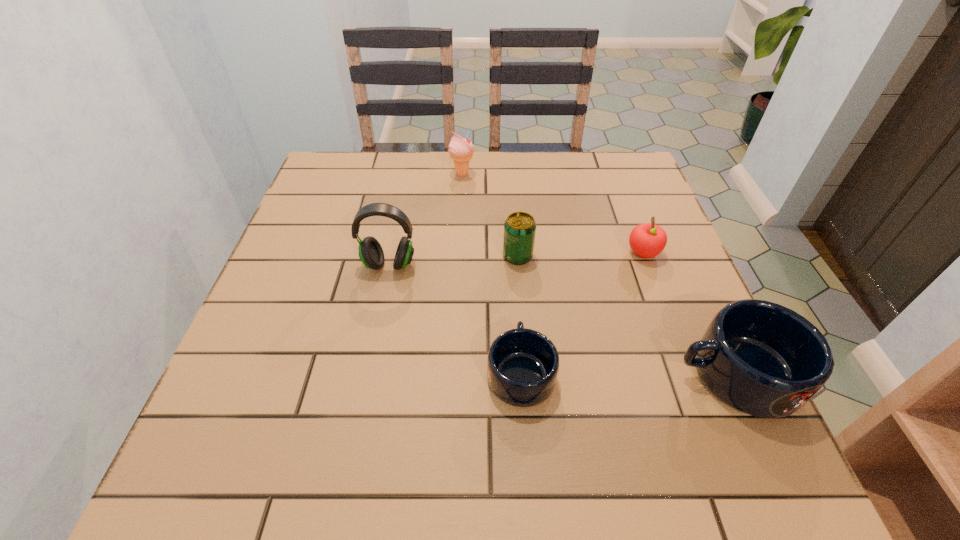
Find the location of a particular element. mug that is positioned at the right edge is located at coordinates (763, 359).

Find the location of `apple that is positioned at the right edge`. apple that is positioned at the right edge is located at coordinates (647, 240).

This screenshot has height=540, width=960. What are the coordinates of `object at the near right corner` in the screenshot? It's located at (763, 359).

Image resolution: width=960 pixels, height=540 pixels. What are the coordinates of `free space at the far edge of the desktop` in the screenshot? It's located at (489, 158).

Locate an element on the screen. Image resolution: width=960 pixels, height=540 pixels. free space at the left edge of the desktop is located at coordinates (307, 306).

Where is `vacant region at the right edge`? This screenshot has height=540, width=960. vacant region at the right edge is located at coordinates (657, 353).

In the image, there is a desktop. Where is `vacant area at the far left corner`? Image resolution: width=960 pixels, height=540 pixels. vacant area at the far left corner is located at coordinates (361, 183).

Find the location of `vacant space in between the leftmost object and the beer can`. vacant space in between the leftmost object and the beer can is located at coordinates (453, 260).

The image size is (960, 540). I want to click on free space between the second object from left to right and the taller mug, so click(599, 274).

Where is `free spot between the right mug and the beer can`? free spot between the right mug and the beer can is located at coordinates (627, 315).